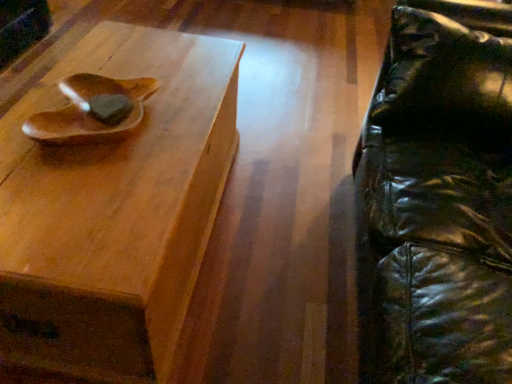
This screenshot has width=512, height=384. Find the location of `empty space that is in between wooden tray at upper left and black leather swivel chair at right`. empty space that is in between wooden tray at upper left and black leather swivel chair at right is located at coordinates (265, 235).